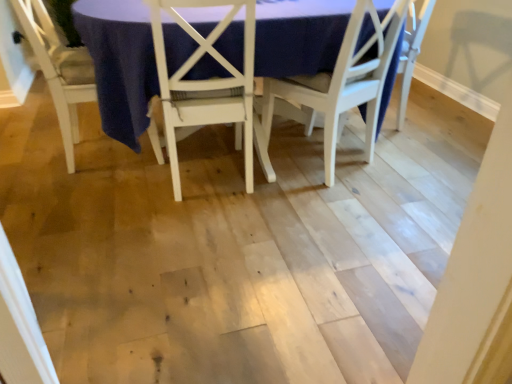
Question: Looking at their shapes, would you say white wood chair at lower left, marked as the 1th chair in a left-to-right arrangement, is wider or thinner than white wood chair at center, placed as the 3th chair when sorted from left to right?

Choices:
 (A) thin
 (B) wide

Answer: (B)

Question: Relative to white wood chair at center, placed as the 3th chair when sorted from left to right, is white wood chair at lower left, which is the 3th chair from right to left, in front or behind?

Choices:
 (A) behind
 (B) front

Answer: (A)

Question: Estimate the real-world distances between objects in this image. Which object is farther from the white wood chair at center, which appears as the 1th chair when viewed from the right?

Choices:
 (A) white wood chair at lower left, which is the 3th chair from right to left
 (B) white wood chair at center, the 2th chair in the left-to-right sequence
 (C) matte white table at center

Answer: (A)

Question: Which object is positioned farthest from the white wood chair at center, placed as the 3th chair when sorted from left to right?

Choices:
 (A) matte white table at center
 (B) white wood chair at lower left, which is the 3th chair from right to left
 (C) white wood chair at center, which is the second chair in right-to-left order

Answer: (B)